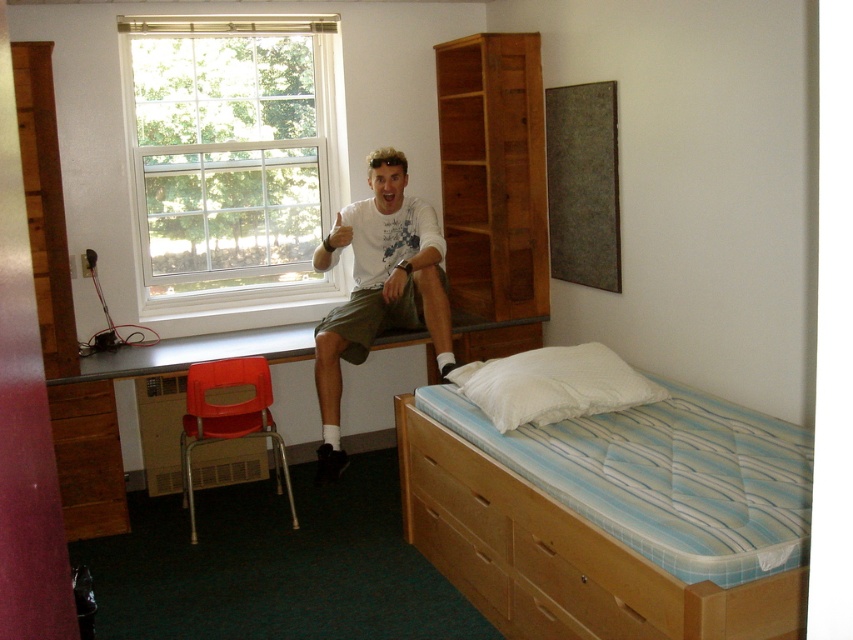
Question: Is white wood window at upper left below metallic desk at lower left?

Choices:
 (A) no
 (B) yes

Answer: (A)

Question: Which point is closer to the camera?

Choices:
 (A) matte plastic chair at lower left
 (B) white soft pillow at lower right

Answer: (B)

Question: Which point is farther to the camera?

Choices:
 (A) white cotton shirt at upper center
 (B) white soft pillow at lower right
 (C) white wood window at upper left
 (D) light blue striped mattress at lower right

Answer: (C)

Question: In this image, where is white cotton shirt at upper center located relative to matte plastic chair at lower left?

Choices:
 (A) left
 (B) right

Answer: (B)

Question: Is the position of light blue striped mattress at lower right more distant than that of matte plastic chair at lower left?

Choices:
 (A) yes
 (B) no

Answer: (B)

Question: Among these objects, which one is farthest from the camera?

Choices:
 (A) white cotton shirt at upper center
 (B) white soft pillow at lower right

Answer: (A)